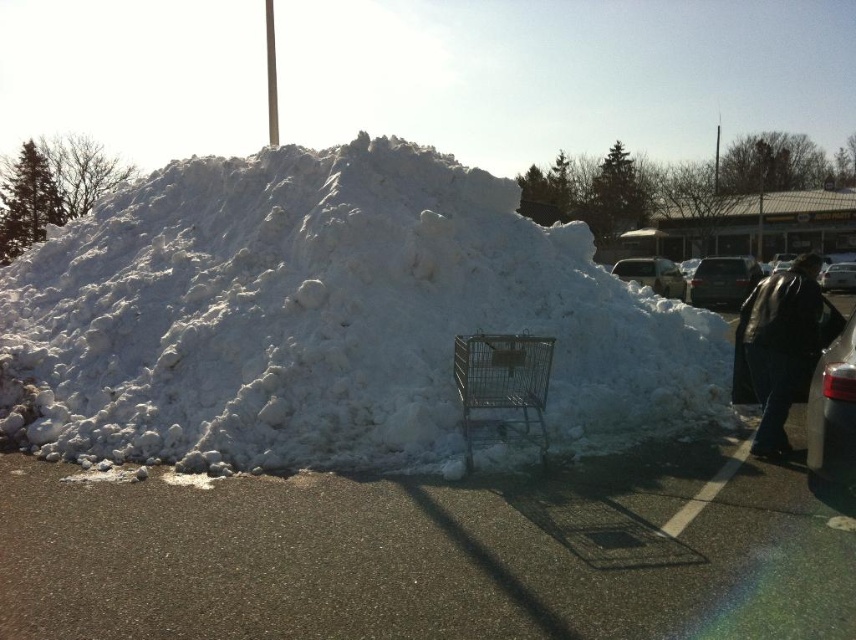
Between white fluffy snow at center and silver metallic sedan at upper right, which one appears on the left side from the viewer's perspective?

Positioned to the left is white fluffy snow at center.

Can you confirm if white fluffy snow at center is positioned to the right of silver metallic sedan at upper right?

In fact, white fluffy snow at center is to the left of silver metallic sedan at upper right.

What are the coordinates of `white fluffy snow at center` in the screenshot? It's located at (331, 316).

At what (x,y) coordinates should I click in order to perform the action: click on white fluffy snow at center. Please return your answer as a coordinate pair (x, y). The image size is (856, 640). Looking at the image, I should click on (331, 316).

Is black leather jacket at lower right positioned in front of shiny silver car at right?

No, black leather jacket at lower right is behind shiny silver car at right.

Identify the location of black leather jacket at lower right. Image resolution: width=856 pixels, height=640 pixels. (779, 348).

Who is taller, shiny silver car at right or silver metallic sedan at upper right?

Standing taller between the two is silver metallic sedan at upper right.

Who is positioned more to the left, shiny silver car at right or silver metallic sedan at upper right?

From the viewer's perspective, shiny silver car at right appears more on the left side.

This screenshot has height=640, width=856. In order to click on shiny silver car at right in this screenshot , I will do `click(831, 410)`.